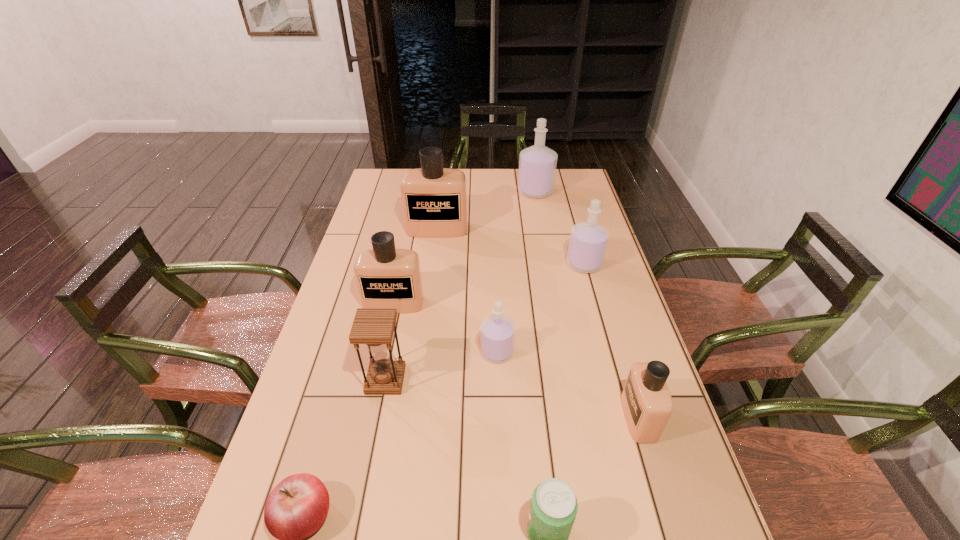
Find the location of a particular element. This screenshot has height=540, width=960. vacant space located on the front label of the nearest beige perfume is located at coordinates (456, 417).

Locate an element on the screen. Image resolution: width=960 pixels, height=540 pixels. vacant position located on the front label of the nearest beige perfume is located at coordinates (465, 417).

This screenshot has height=540, width=960. What are the coordinates of `object that is at the far edge` in the screenshot? It's located at point(537,164).

Identify the location of perfume that is at the left edge. (386, 277).

At what (x,y) coordinates should I click in order to perform the action: click on hourglass located at the left edge. Please return your answer as a coordinate pair (x, y). This screenshot has width=960, height=540. Looking at the image, I should click on (374, 327).

You are a GUI agent. You are given a task and a screenshot of the screen. Output one action in this format:
    pyautogui.click(x=<x>, y=<y>)
    Task: Click on the object present at the far right corner
    The height and width of the screenshot is (540, 960).
    Given the screenshot: What is the action you would take?
    pyautogui.click(x=537, y=164)

The image size is (960, 540). In the image, there is a desktop. In order to click on free region at the far edge in this screenshot , I will do `click(514, 173)`.

I want to click on vacant space at the left edge, so click(334, 366).

At what (x,y) coordinates should I click in order to perform the action: click on free location at the right edge of the desktop. Please return your answer as a coordinate pair (x, y). Looking at the image, I should click on (625, 312).

I want to click on vacant space at the far right corner of the desktop, so click(x=563, y=197).